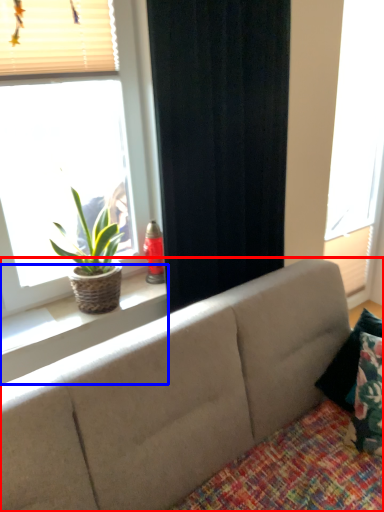
Question: Among these objects, which one is farthest to the camera, studio couch (highlighted by a red box) or window sill (highlighted by a blue box)?

Choices:
 (A) studio couch
 (B) window sill

Answer: (B)